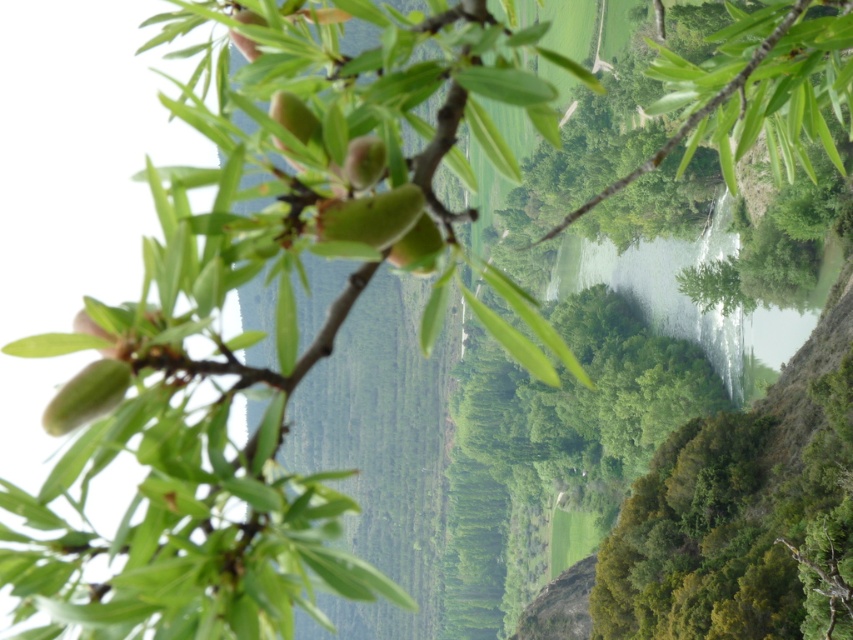
In the scene shown: You are an ornithologist observing this scene. You notice the green matte leaves at center and the green leafy branch at center. Which object is located below the other?

The green matte leaves at center are positioned under the green leafy branch at center, so the leaves are below the branch.

You are an artist sketching the scene and want to draw the green matte leaves at center and the green leafy branch at center. Which object should you sketch first if you start from the left side of the page?

You should sketch the green matte leaves at center first because it is positioned to the left of the green leafy branch at center.